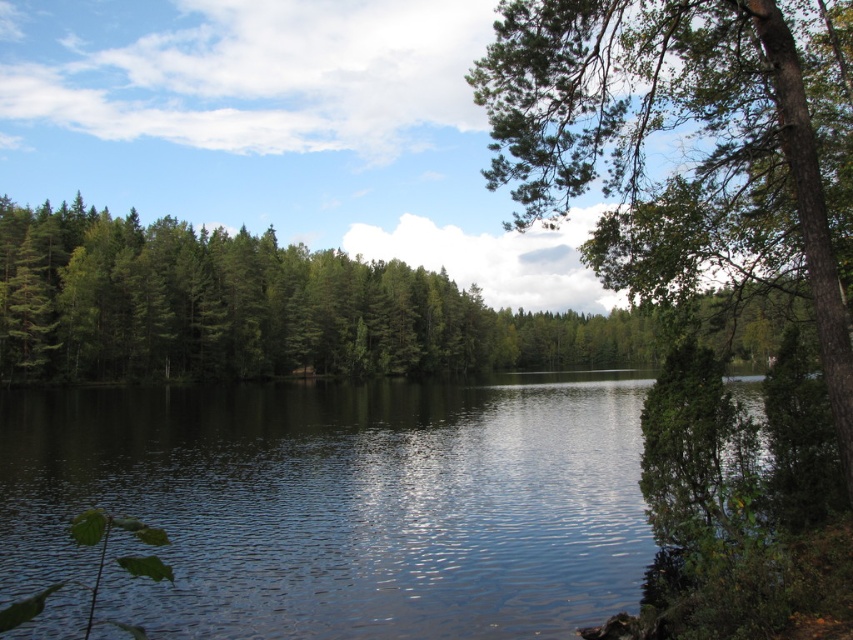
You are a photographer trying to capture the reflection of the green textured tree at upper right in the clear water at center. Based on the scene, will the tree be visible in the reflection?

The green textured tree at upper right is behind the clear water at center, so its reflection would not be visible in the water since the tree is positioned behind the water surface.